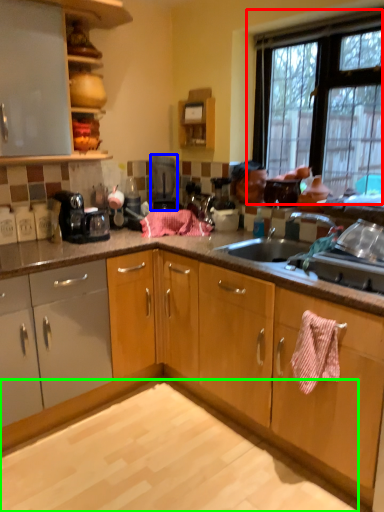
Question: Estimate the real-world distances between objects in this image. Which object is farther from window (highlighted by a red box), kitchen appliance (highlighted by a blue box) or granite (highlighted by a green box)?

Choices:
 (A) kitchen appliance
 (B) granite

Answer: (B)